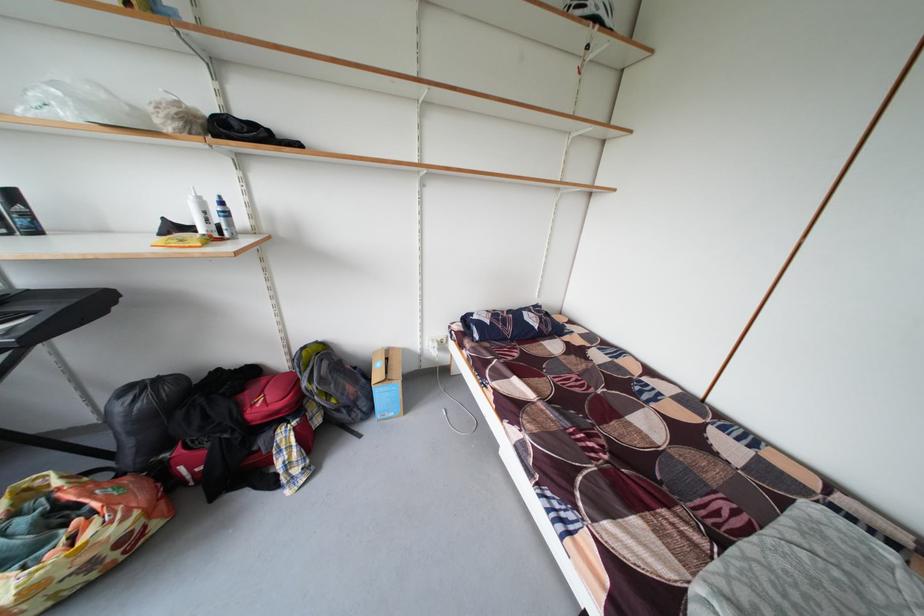
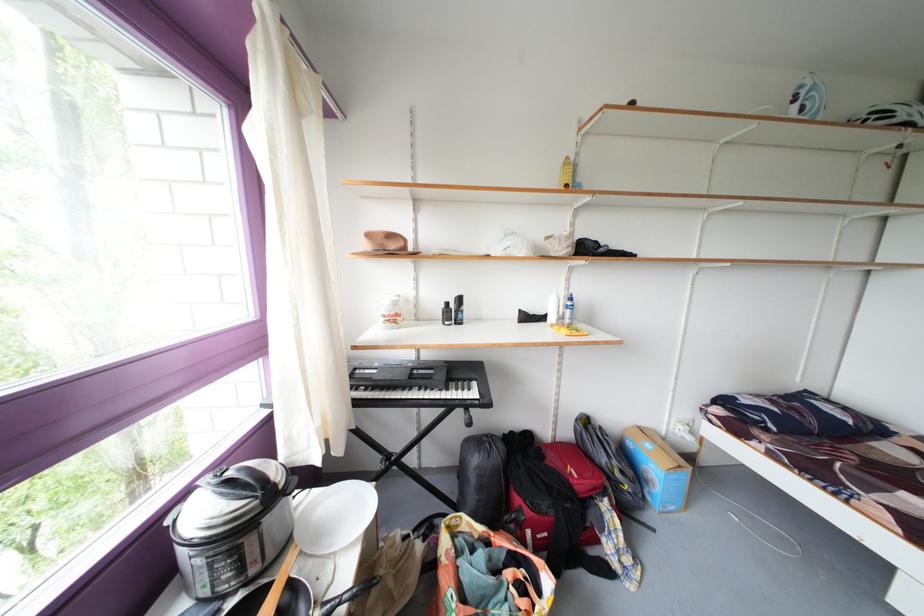
Question: Which direction would the cameraman need to move to produce the second image? Reply with the corresponding letter.

Choices:
 (A) Left
 (B) Right
 (C) Forward
 (D) Backward

Answer: (A)